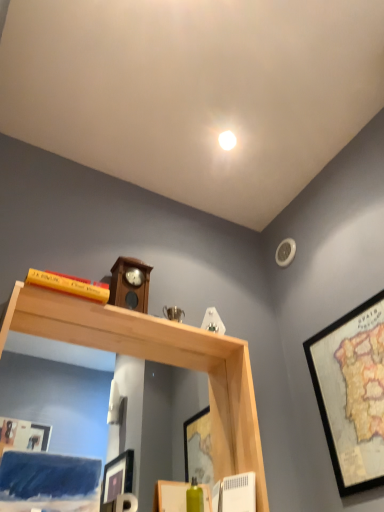
Question: Is yellow matte bookshelf at upper left oriented away from wooden framed map at right?

Choices:
 (A) yes
 (B) no

Answer: (B)

Question: From a real-world perspective, is yellow matte bookshelf at upper left on top of wooden framed map at right?

Choices:
 (A) yes
 (B) no

Answer: (A)

Question: Considering the relative sizes of yellow matte bookshelf at upper left and wooden framed map at right in the image provided, is yellow matte bookshelf at upper left taller than wooden framed map at right?

Choices:
 (A) yes
 (B) no

Answer: (B)

Question: Is yellow matte bookshelf at upper left closer to the viewer compared to wooden framed map at right?

Choices:
 (A) yes
 (B) no

Answer: (B)

Question: Does yellow matte bookshelf at upper left have a lesser height compared to wooden framed map at right?

Choices:
 (A) no
 (B) yes

Answer: (B)

Question: Is wooden framed map at right taller or shorter than natural wood mirror at upper center?

Choices:
 (A) short
 (B) tall

Answer: (A)

Question: Visually, is wooden framed map at right positioned to the left or to the right of natural wood mirror at upper center?

Choices:
 (A) left
 (B) right

Answer: (B)

Question: Looking at their shapes, would you say wooden framed map at right is wider or thinner than natural wood mirror at upper center?

Choices:
 (A) thin
 (B) wide

Answer: (A)

Question: Relative to natural wood mirror at upper center, is wooden framed map at right in front or behind?

Choices:
 (A) front
 (B) behind

Answer: (B)

Question: Is yellow matte bookshelf at upper left bigger or smaller than wooden framed map at right?

Choices:
 (A) small
 (B) big

Answer: (A)

Question: Looking at their shapes, would you say yellow matte bookshelf at upper left is wider or thinner than wooden framed map at right?

Choices:
 (A) wide
 (B) thin

Answer: (A)

Question: From the image's perspective, is yellow matte bookshelf at upper left above or below wooden framed map at right?

Choices:
 (A) below
 (B) above

Answer: (B)

Question: From a real-world perspective, is yellow matte bookshelf at upper left positioned above or below wooden framed map at right?

Choices:
 (A) below
 (B) above

Answer: (B)

Question: Is point (321, 400) positioned closer to the camera than point (56, 289)?

Choices:
 (A) farther
 (B) closer

Answer: (A)

Question: In terms of height, does wooden framed map at right look taller or shorter compared to yellow matte bookshelf at upper left?

Choices:
 (A) tall
 (B) short

Answer: (A)